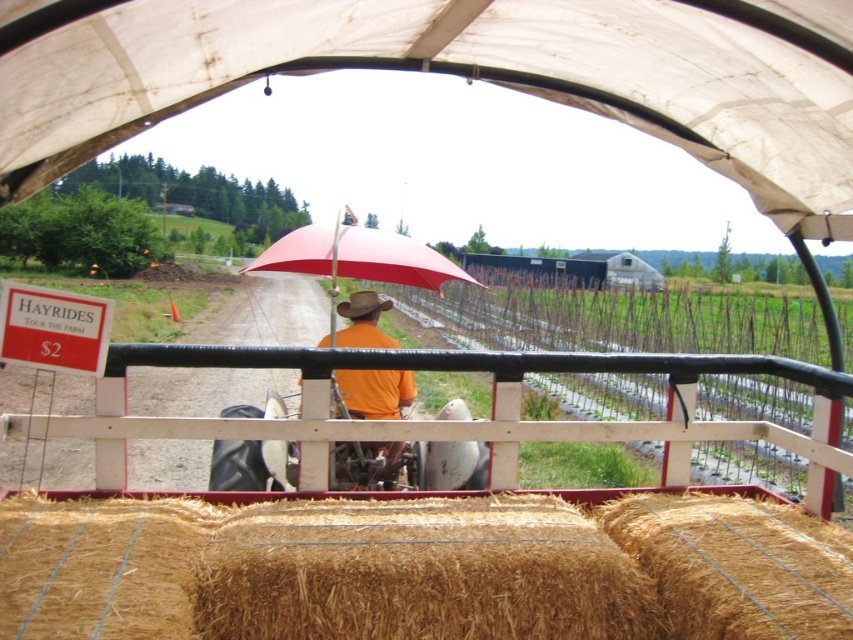
Question: Which point is closer to the camera?

Choices:
 (A) orange cotton shirt at center
 (B) golden straw bales at lower center
 (C) red matte umbrella at center
 (D) white fabric canopy at upper center

Answer: (D)

Question: Which object appears closest to the camera in this image?

Choices:
 (A) orange cotton shirt at center
 (B) golden straw bales at lower center
 (C) red matte umbrella at center
 (D) white fabric canopy at upper center

Answer: (D)

Question: Is red matte umbrella at center bigger than orange cotton shirt at center?

Choices:
 (A) no
 (B) yes

Answer: (B)

Question: In this image, where is golden straw bales at lower center located relative to white fabric canopy at upper center?

Choices:
 (A) left
 (B) right

Answer: (A)

Question: Which point is closer to the camera taking this photo?

Choices:
 (A) tap(340, 381)
 (B) tap(367, 234)
 (C) tap(703, 115)

Answer: (C)

Question: Can you confirm if golden straw bales at lower center is positioned to the right of orange cotton shirt at center?

Choices:
 (A) no
 (B) yes

Answer: (B)